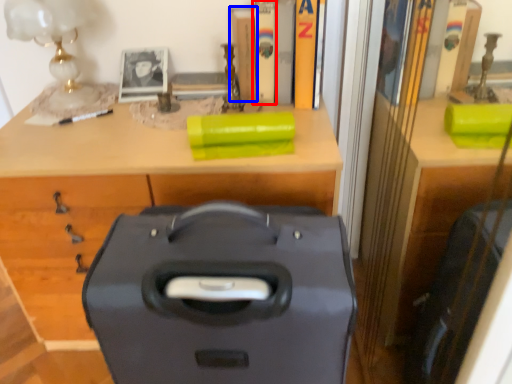
Question: Which object appears farthest to the camera in this image, book (highlighted by a red box) or book (highlighted by a blue box)?

Choices:
 (A) book
 (B) book

Answer: (B)